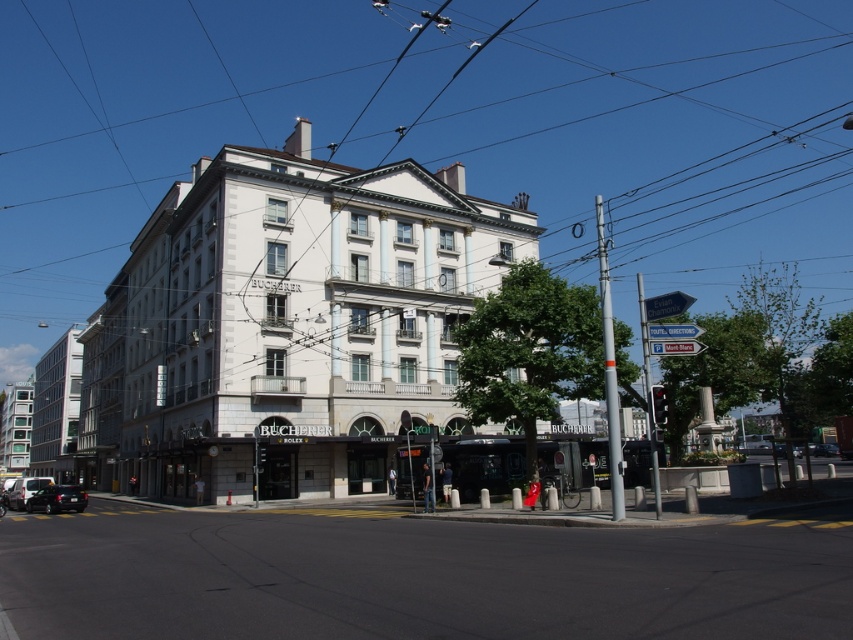
Question: Does black asphalt road at lower center appear under shiny black car at lower left?

Choices:
 (A) yes
 (B) no

Answer: (B)

Question: Does black asphalt road at lower center have a lesser width compared to shiny black car at lower left?

Choices:
 (A) yes
 (B) no

Answer: (A)

Question: Which point appears closest to the camera in this image?

Choices:
 (A) (564, 560)
 (B) (82, 493)

Answer: (A)

Question: Can you confirm if black asphalt road at lower center is bigger than shiny black car at lower left?

Choices:
 (A) yes
 (B) no

Answer: (B)